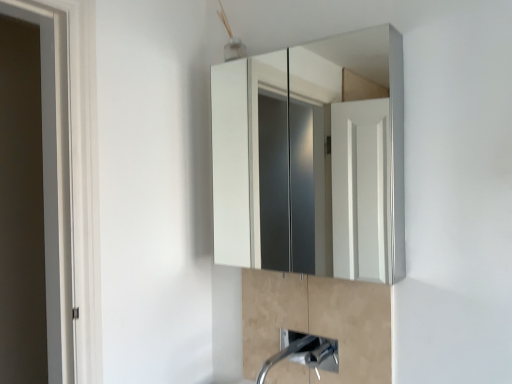
Question: Should I look upward or downward to see satin nickel faucet at lower center?

Choices:
 (A) down
 (B) up

Answer: (A)

Question: From a real-world perspective, is white glossy medicine cabinet at upper center on satin nickel faucet at lower center?

Choices:
 (A) no
 (B) yes

Answer: (B)

Question: Is white glossy medicine cabinet at upper center placed right next to satin nickel faucet at lower center?

Choices:
 (A) no
 (B) yes

Answer: (A)

Question: Is white glossy medicine cabinet at upper center oriented towards satin nickel faucet at lower center?

Choices:
 (A) no
 (B) yes

Answer: (A)

Question: Is white glossy medicine cabinet at upper center positioned behind satin nickel faucet at lower center?

Choices:
 (A) yes
 (B) no

Answer: (B)

Question: Is white glossy medicine cabinet at upper center positioned far away from satin nickel faucet at lower center?

Choices:
 (A) no
 (B) yes

Answer: (A)

Question: From the image's perspective, would you say white glossy medicine cabinet at upper center is positioned over satin nickel faucet at lower center?

Choices:
 (A) yes
 (B) no

Answer: (A)

Question: Are satin nickel faucet at lower center and white glossy medicine cabinet at upper center located far from each other?

Choices:
 (A) yes
 (B) no

Answer: (B)

Question: Does satin nickel faucet at lower center appear on the left side of white glossy medicine cabinet at upper center?

Choices:
 (A) yes
 (B) no

Answer: (B)

Question: Does satin nickel faucet at lower center have a lesser height compared to white glossy medicine cabinet at upper center?

Choices:
 (A) yes
 (B) no

Answer: (A)

Question: Is the position of satin nickel faucet at lower center more distant than that of white glossy medicine cabinet at upper center?

Choices:
 (A) yes
 (B) no

Answer: (A)

Question: Is satin nickel faucet at lower center placed right next to white glossy medicine cabinet at upper center?

Choices:
 (A) yes
 (B) no

Answer: (B)

Question: Can you confirm if satin nickel faucet at lower center is thinner than white glossy medicine cabinet at upper center?

Choices:
 (A) yes
 (B) no

Answer: (A)

Question: Is satin nickel faucet at lower center to the left of satin nickel faucet at lower center from the viewer's perspective?

Choices:
 (A) yes
 (B) no

Answer: (B)